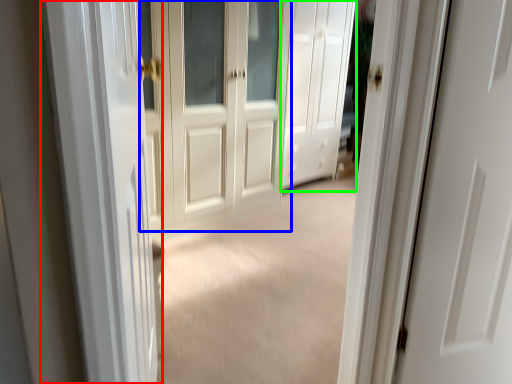
Question: Which object is the closest to the screen door (highlighted by a red box)? Choose among these: door (highlighted by a blue box) or door (highlighted by a green box).

Choices:
 (A) door
 (B) door

Answer: (A)